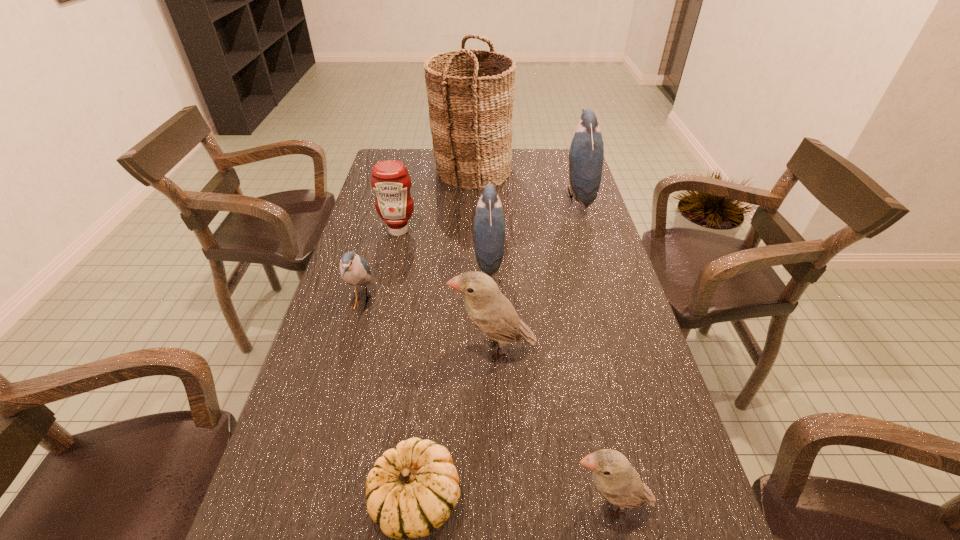
Find the location of a particular element. This screenshot has height=540, width=960. bird that is at the left edge is located at coordinates (354, 269).

Find the location of `vacant space at the left edge`. vacant space at the left edge is located at coordinates (353, 428).

Locate an element on the screen. The image size is (960, 540). free location at the right edge is located at coordinates (598, 269).

Locate an element on the screen. This screenshot has height=540, width=960. blank space at the far left corner of the desktop is located at coordinates (403, 156).

Find the location of `empty space that is in between the tallest object and the red condiment`. empty space that is in between the tallest object and the red condiment is located at coordinates (435, 200).

Identify the location of empty space that is in between the red condiment and the farther white bird. (445, 289).

You are a GUI agent. You are given a task and a screenshot of the screen. Output one action in this format:
    pyautogui.click(x=<x>, y=<y>)
    Task: Click on the empty space that is in between the fourth farthest bird and the nearest bird
    This screenshot has height=540, width=960.
    Given the screenshot: What is the action you would take?
    pyautogui.click(x=551, y=427)

Find the location of `free space between the leftmost bird and the biggest blue bird`. free space between the leftmost bird and the biggest blue bird is located at coordinates (469, 249).

This screenshot has height=540, width=960. I want to click on unoccupied area between the farthest bird and the third nearest object, so click(x=536, y=273).

This screenshot has width=960, height=540. What are the coordinates of `object that is the sixth nearest to the seventh shortest object` in the screenshot? It's located at (617, 481).